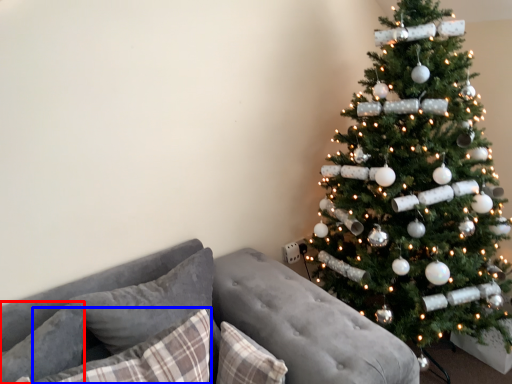
Question: Which object is closer to the camera taking this photo, pillow (highlighted by a red box) or pillow (highlighted by a blue box)?

Choices:
 (A) pillow
 (B) pillow

Answer: (B)